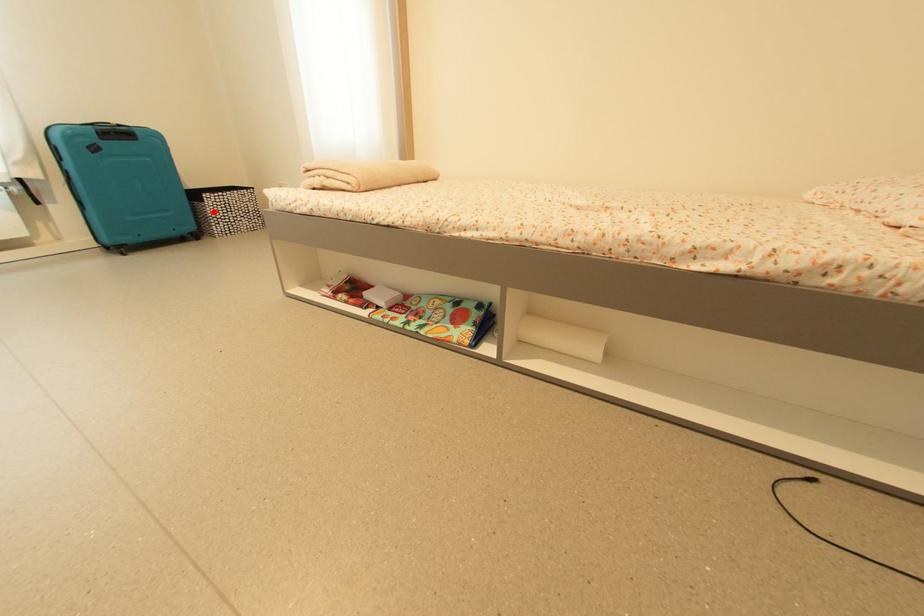
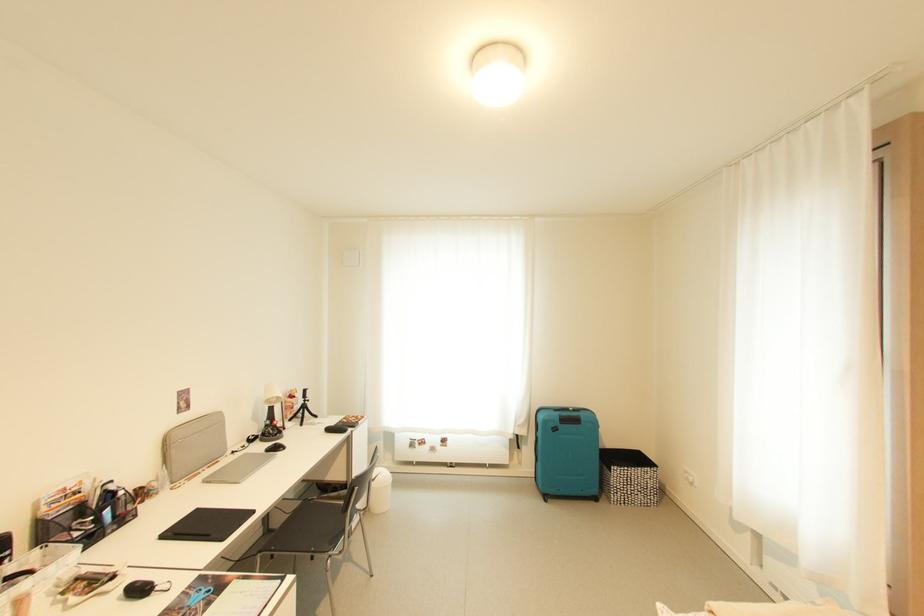
Question: A red point is marked in image1. In image2, is the corresponding 3D point closer to the camera or farther? Reply with the corresponding letter.

Choices:
 (A) The corresponding 3D point is closer.
 (B) The corresponding 3D point is farther.

Answer: (B)